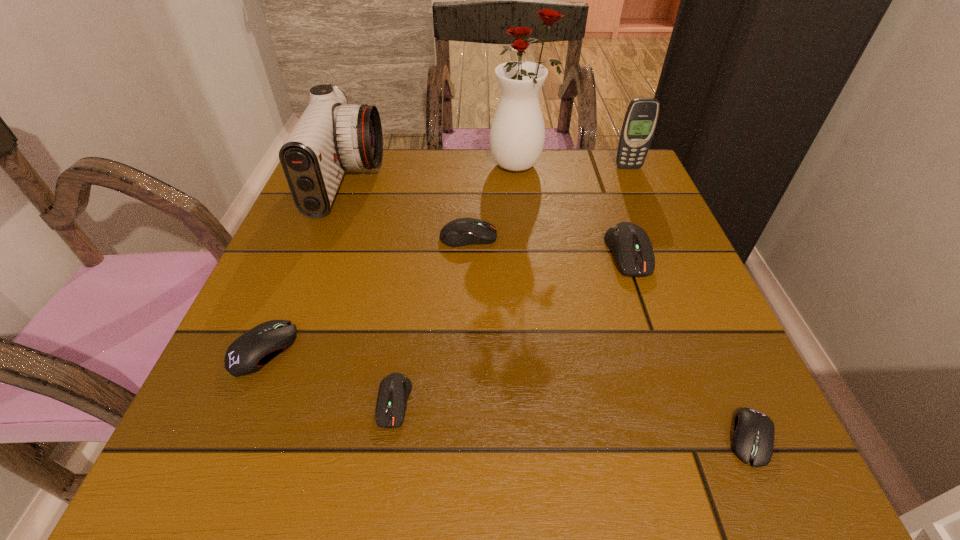
Locate an element on the screen. This screenshot has width=960, height=540. vacant space located 0.060m on the left of the right black computer equipment is located at coordinates (684, 438).

This screenshot has height=540, width=960. I want to click on vase present at the far edge, so click(517, 135).

This screenshot has width=960, height=540. Find the location of `camcorder located at the far edge`. camcorder located at the far edge is located at coordinates (331, 136).

This screenshot has width=960, height=540. Find the location of `cellular telephone that is at the far edge`. cellular telephone that is at the far edge is located at coordinates (641, 117).

This screenshot has width=960, height=540. I want to click on camcorder at the left edge, so click(331, 136).

Locate an element on the screen. The width and height of the screenshot is (960, 540). computer equipment located at the left edge is located at coordinates (249, 353).

The width and height of the screenshot is (960, 540). In order to click on cellular telephone situated at the right edge in this screenshot , I will do `click(641, 117)`.

Find the location of a particular element. Image resolution: width=960 pixels, height=540 pixels. object situated at the far left corner is located at coordinates (331, 136).

At what (x,y) coordinates should I click in order to perform the action: click on object located at the far right corner. Please return your answer as a coordinate pair (x, y). Looking at the image, I should click on (641, 117).

Find the location of a particular element. Image resolution: width=960 pixels, height=540 pixels. object that is at the near right corner is located at coordinates (753, 439).